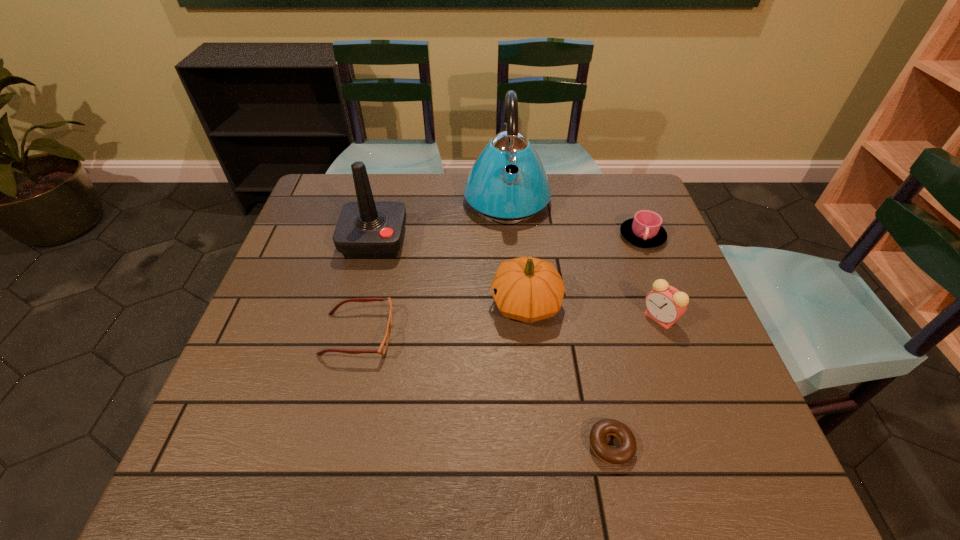
The width and height of the screenshot is (960, 540). Identify the location of free spot that satisfies the following two spatial constraints: 1. at the spout of the kettle; 2. on the front-facing side of the spectacles. (516, 335).

Identify the location of blank area in the image that satisfies the following two spatial constraints: 1. on the side with the handle of the third shortest object; 2. on the face of the alarm clock. (674, 318).

This screenshot has height=540, width=960. Identify the location of free location that satisfies the following two spatial constraints: 1. on the side with the handle of the cup; 2. on the front-facing side of the spectacles. (681, 335).